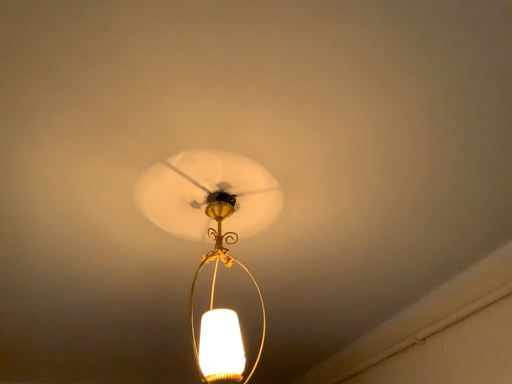
The width and height of the screenshot is (512, 384). What are the coordinates of `matte gold lampshade at center` in the screenshot? It's located at [210, 202].

This screenshot has width=512, height=384. Describe the element at coordinates (210, 202) in the screenshot. I see `matte gold lampshade at center` at that location.

Image resolution: width=512 pixels, height=384 pixels. I want to click on matte gold lampshade at center, so click(210, 202).